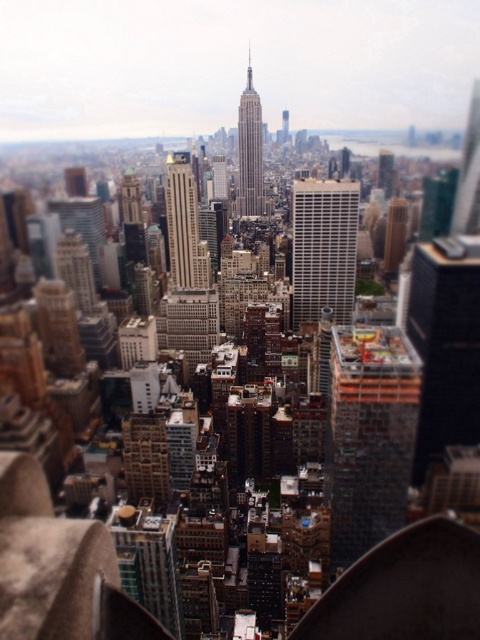
Question: Is dark gray concrete construction at center smaller than gray stone tower at center?

Choices:
 (A) no
 (B) yes

Answer: (A)

Question: Based on their relative distances, which object is nearer to the gray stone tower at center?

Choices:
 (A) white glass building at center
 (B) smooth glass skyscraper at center
 (C) dark gray concrete construction at center

Answer: (B)

Question: Estimate the real-world distances between objects in this image. Which object is closer to the dark gray concrete construction at center?

Choices:
 (A) gray stone tower at center
 (B) white glass building at center

Answer: (B)

Question: Is dark gray concrete construction at center positioned behind gray stone tower at center?

Choices:
 (A) no
 (B) yes

Answer: (A)

Question: Which of the following is the farthest from the observer?

Choices:
 (A) (252, 90)
 (B) (345, 560)
 (C) (193, 218)
 (D) (343, 221)

Answer: (A)

Question: Does white glass building at center have a greater width compared to smooth glass skyscraper at center?

Choices:
 (A) no
 (B) yes

Answer: (B)